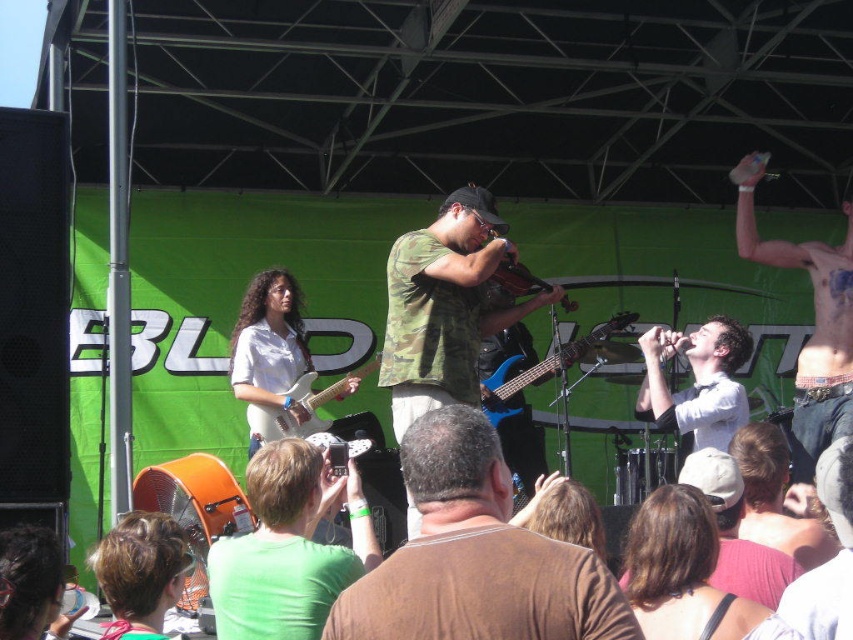
Is the position of green fabric shirt at center less distant than that of brown hair at lower center?

No.

In the scene shown: Can you confirm if green fabric shirt at center is wider than brown hair at lower center?

Yes, green fabric shirt at center is wider than brown hair at lower center.

Which is in front, point (306, 497) or point (646, 625)?

Point (646, 625)

Locate an element on the screen. green fabric shirt at center is located at coordinates (288, 547).

Measure the distance between pink fabric shirt at lower right and green fabric shirt at lower left.

pink fabric shirt at lower right and green fabric shirt at lower left are 2.76 meters apart from each other.

Looking at this image, does pink fabric shirt at lower right have a lesser height compared to green fabric shirt at lower left?

Incorrect, pink fabric shirt at lower right's height does not fall short of green fabric shirt at lower left's.

Is point (764, 438) behind point (38, 632)?

Yes.

What are the coordinates of `pink fabric shirt at lower right` in the screenshot? It's located at (775, 499).

The image size is (853, 640). Describe the element at coordinates (680, 570) in the screenshot. I see `brown hair at lower center` at that location.

Consider the image. Is brown hair at lower center below pink fabric shirt at lower right?

Indeed, brown hair at lower center is positioned under pink fabric shirt at lower right.

Which is in front, point (683, 628) or point (741, 528)?

Point (683, 628)

The height and width of the screenshot is (640, 853). Find the location of `brown hair at lower center`. brown hair at lower center is located at coordinates (680, 570).